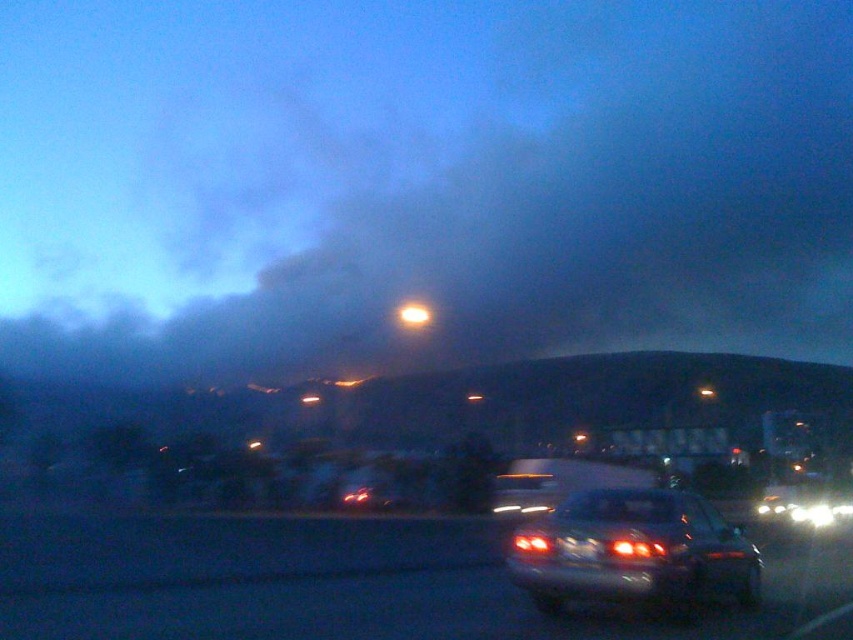
Question: Can you confirm if smoke/dense at upper center is positioned to the left of matte silver sedan at center?

Choices:
 (A) yes
 (B) no

Answer: (A)

Question: Is the position of smoke/dense at upper center more distant than that of metallic silver car at lower center?

Choices:
 (A) yes
 (B) no

Answer: (A)

Question: Observing the image, what is the correct spatial positioning of matte silver sedan at center in reference to white glossy car at lower right?

Choices:
 (A) left
 (B) right

Answer: (A)

Question: Considering the real-world distances, which object is farthest from the metallic silver car at lower center?

Choices:
 (A) white glossy car at lower right
 (B) matte silver sedan at center

Answer: (A)

Question: Which object appears closest to the camera in this image?

Choices:
 (A) smoke/dense at upper center
 (B) metallic silver car at lower center
 (C) white glossy car at lower right

Answer: (B)

Question: Considering the real-world distances, which object is closest to the matte silver sedan at center?

Choices:
 (A) smoke/dense at upper center
 (B) metallic silver car at lower center

Answer: (B)